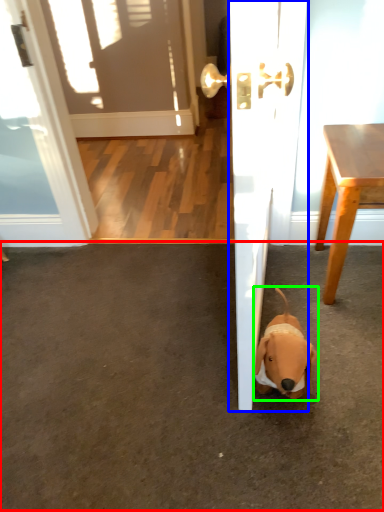
Question: Which is nearer to the concrete (highlighted by a red box)? door (highlighted by a blue box) or dog (highlighted by a green box).

Choices:
 (A) door
 (B) dog

Answer: (B)